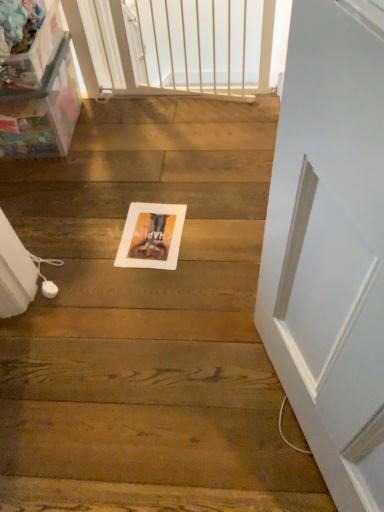
Question: Is white matte screen door at upper center at the right side of white paper postcard at center?

Choices:
 (A) no
 (B) yes

Answer: (B)

Question: Can you confirm if white matte screen door at upper center is positioned to the left of white paper postcard at center?

Choices:
 (A) no
 (B) yes

Answer: (A)

Question: Can white paper postcard at center be found inside white matte screen door at upper center?

Choices:
 (A) no
 (B) yes

Answer: (A)

Question: Is white matte screen door at upper center facing towards white paper postcard at center?

Choices:
 (A) no
 (B) yes

Answer: (B)

Question: Is white matte screen door at upper center closer to camera compared to white paper postcard at center?

Choices:
 (A) yes
 (B) no

Answer: (B)

Question: Does white matte screen door at upper center have a lesser width compared to white paper postcard at center?

Choices:
 (A) no
 (B) yes

Answer: (B)

Question: From a real-world perspective, is white paper postcard at center beneath white matte screen door at upper center?

Choices:
 (A) yes
 (B) no

Answer: (A)

Question: Can you confirm if white paper postcard at center is thinner than white matte screen door at upper center?

Choices:
 (A) yes
 (B) no

Answer: (B)

Question: Considering the relative sizes of white paper postcard at center and white matte screen door at upper center in the image provided, is white paper postcard at center wider than white matte screen door at upper center?

Choices:
 (A) yes
 (B) no

Answer: (A)

Question: Considering the relative positions of white paper postcard at center and white matte screen door at upper center in the image provided, is white paper postcard at center to the right of white matte screen door at upper center from the viewer's perspective?

Choices:
 (A) yes
 (B) no

Answer: (B)

Question: Is white paper postcard at center positioned far away from white matte screen door at upper center?

Choices:
 (A) no
 (B) yes

Answer: (A)

Question: Is white paper postcard at center shorter than white matte screen door at upper center?

Choices:
 (A) no
 (B) yes

Answer: (B)

Question: Is point (144, 250) closer or farther from the camera than point (132, 91)?

Choices:
 (A) farther
 (B) closer

Answer: (B)